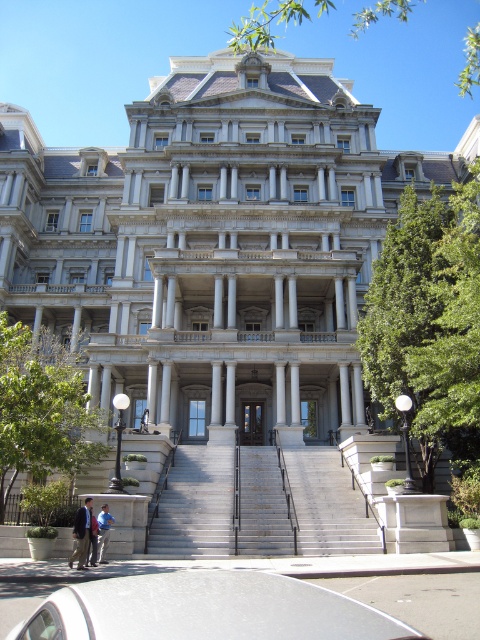
Can you confirm if silver metallic car at lower center is thinner than blue denim jeans at lower left?

In fact, silver metallic car at lower center might be wider than blue denim jeans at lower left.

Does silver metallic car at lower center have a smaller size compared to blue denim jeans at lower left?

No, silver metallic car at lower center is not smaller than blue denim jeans at lower left.

Is point (119, 605) closer to viewer compared to point (106, 528)?

That is True.

I want to click on silver metallic car at lower center, so click(x=205, y=609).

Can you confirm if gray concrete stairs at center is bigger than blue denim jeans at lower left?

Yes, gray concrete stairs at center is bigger than blue denim jeans at lower left.

How far apart are gray concrete stairs at center and blue denim jeans at lower left?

A distance of 13.83 meters exists between gray concrete stairs at center and blue denim jeans at lower left.

Image resolution: width=480 pixels, height=640 pixels. What are the coordinates of `gray concrete stairs at center` in the screenshot? It's located at (195, 504).

Is gray concrete stairs at center taller than dark gray suit at lower left?

Indeed, gray concrete stairs at center has a greater height compared to dark gray suit at lower left.

Is point (247, 458) behind point (71, 560)?

That is True.

This screenshot has width=480, height=640. What are the coordinates of `gray concrete stairs at center` in the screenshot? It's located at (195, 504).